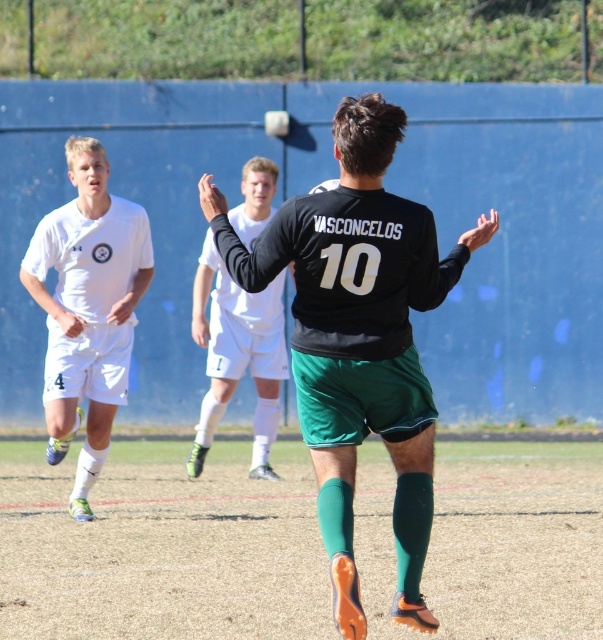
Question: Which point is closer to the camera taking this photo?

Choices:
 (A) (33, 259)
 (B) (368, 416)

Answer: (B)

Question: Estimate the real-world distances between objects in this image. Which object is farther from the black matte jersey at center?

Choices:
 (A) white matte soccer uniform at left
 (B) white jersey at center

Answer: (B)

Question: Which point is farther to the camera?

Choices:
 (A) (306, 211)
 (B) (253, 298)

Answer: (B)

Question: Where is white matte soccer uniform at left located in relation to white jersey at center in the image?

Choices:
 (A) right
 (B) left

Answer: (B)

Question: Can you confirm if white matte soccer uniform at left is positioned below white jersey at center?

Choices:
 (A) no
 (B) yes

Answer: (A)

Question: Can you confirm if white matte soccer uniform at left is positioned above white jersey at center?

Choices:
 (A) no
 (B) yes

Answer: (B)